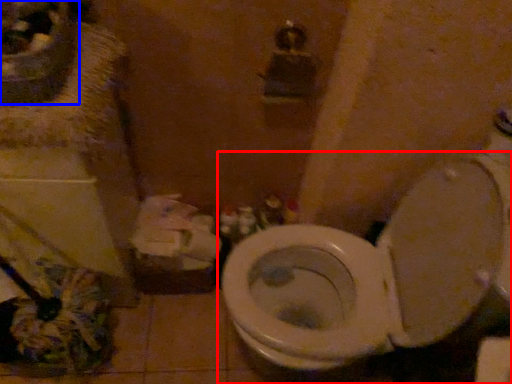
Question: Which object appears closest to the camera in this image, toilet (highlighted by a red box) or sink (highlighted by a blue box)?

Choices:
 (A) toilet
 (B) sink

Answer: (A)